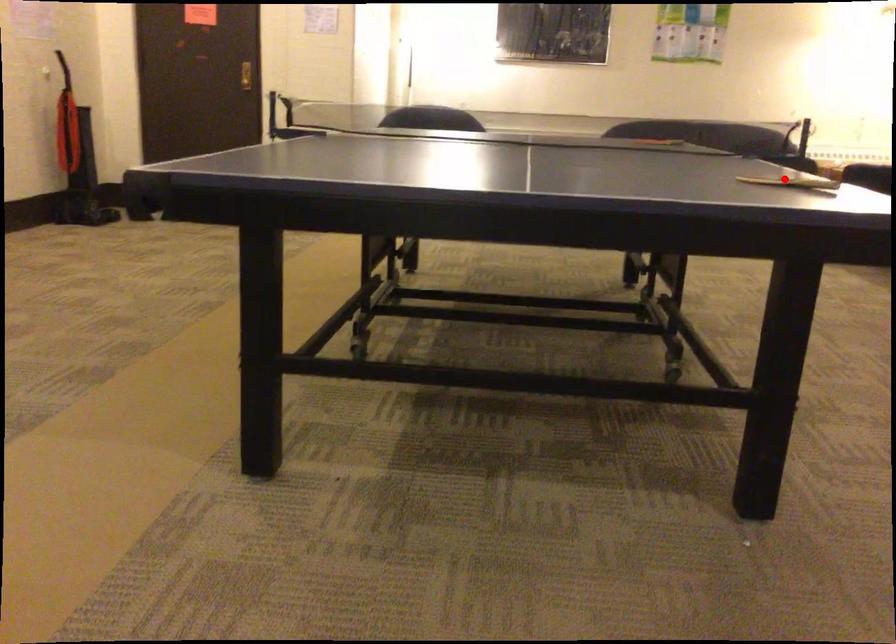
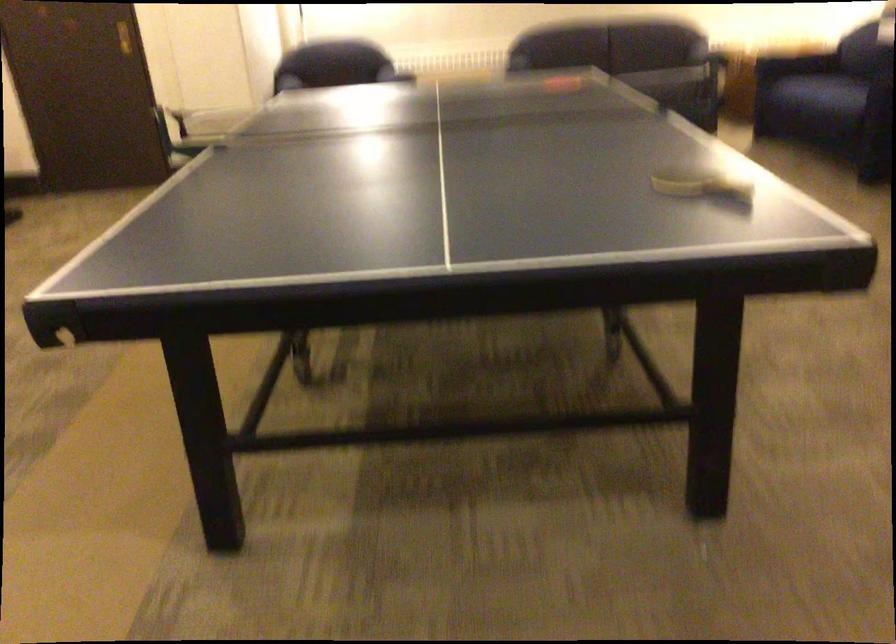
Find the pixel in the second image that matches the highlighted location in the first image.

(701, 184)